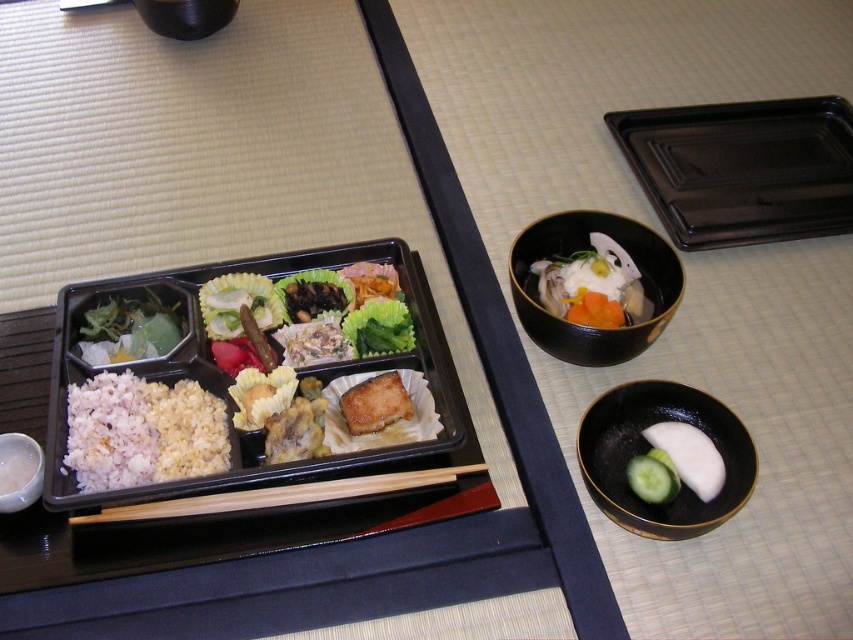
Question: Among these points, which one is nearest to the camera?

Choices:
 (A) (408, 348)
 (B) (376, 467)

Answer: (B)

Question: Which of the following is the farthest from the observer?

Choices:
 (A) (403, 305)
 (B) (613, 236)
 (C) (320, 321)
 (D) (292, 428)

Answer: (B)

Question: Among these objects, which one is nearest to the camera?

Choices:
 (A) green smooth cucumber at lower right
 (B) wooden chopsticks at center
 (C) white rice at center
 (D) black ceramic bowl at upper right

Answer: (B)

Question: Does black plastic tray at upper right have a greater width compared to black ceramic bowl at upper right?

Choices:
 (A) no
 (B) yes

Answer: (B)

Question: Can you confirm if black plastic tray at center is smaller than green leafy vegetable at center?

Choices:
 (A) no
 (B) yes

Answer: (A)

Question: Does wooden chopsticks at center appear on the right side of green smooth cucumber at lower right?

Choices:
 (A) no
 (B) yes

Answer: (A)